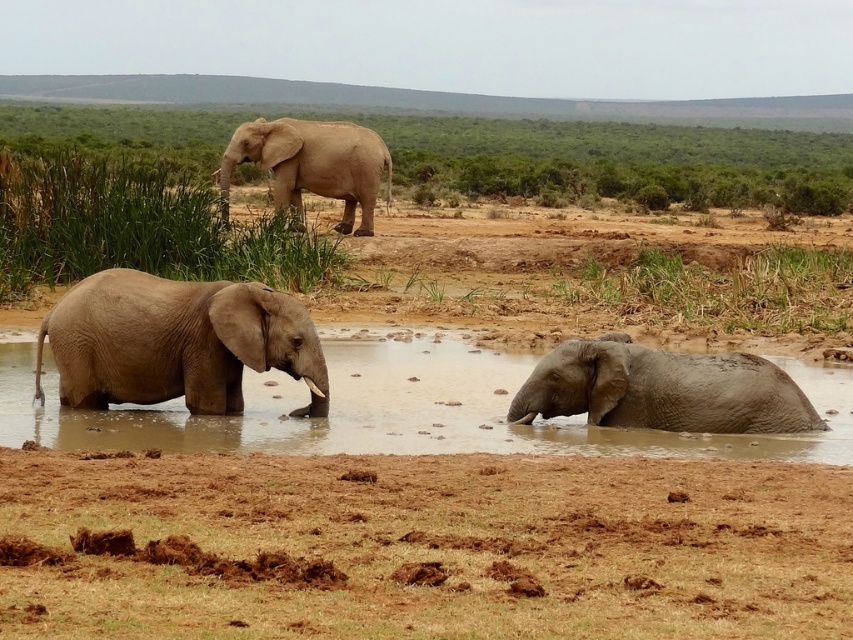
Between gray matte elephant at lower right and gray matte elephant at upper center, which one has more height?

Standing taller between the two is gray matte elephant at upper center.

Is point (590, 374) behind point (335, 163)?

No, it is not.

The width and height of the screenshot is (853, 640). I want to click on gray matte elephant at lower right, so pos(663,390).

The image size is (853, 640). What do you see at coordinates (431, 547) in the screenshot?
I see `brown dry soil at lower center` at bounding box center [431, 547].

This screenshot has width=853, height=640. Find the location of `brown dry soil at lower center`. brown dry soil at lower center is located at coordinates (431, 547).

Is brown muddy water at center to the left of grayish-brown wrinkled skin elephant at lower left from the viewer's perspective?

Incorrect, brown muddy water at center is not on the left side of grayish-brown wrinkled skin elephant at lower left.

Does brown muddy water at center come behind grayish-brown wrinkled skin elephant at lower left?

No, brown muddy water at center is in front of grayish-brown wrinkled skin elephant at lower left.

Find the location of `brown muddy water at center`. brown muddy water at center is located at coordinates (398, 412).